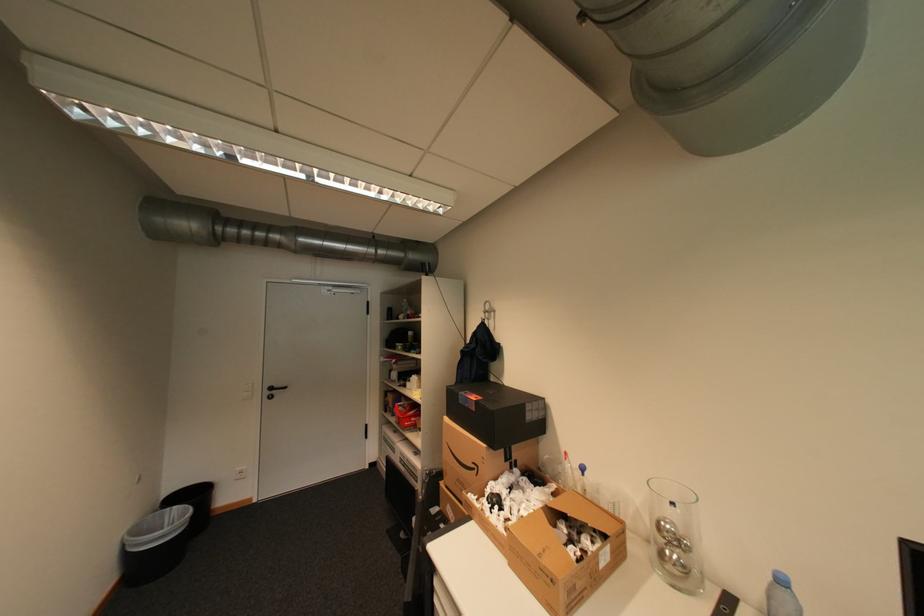
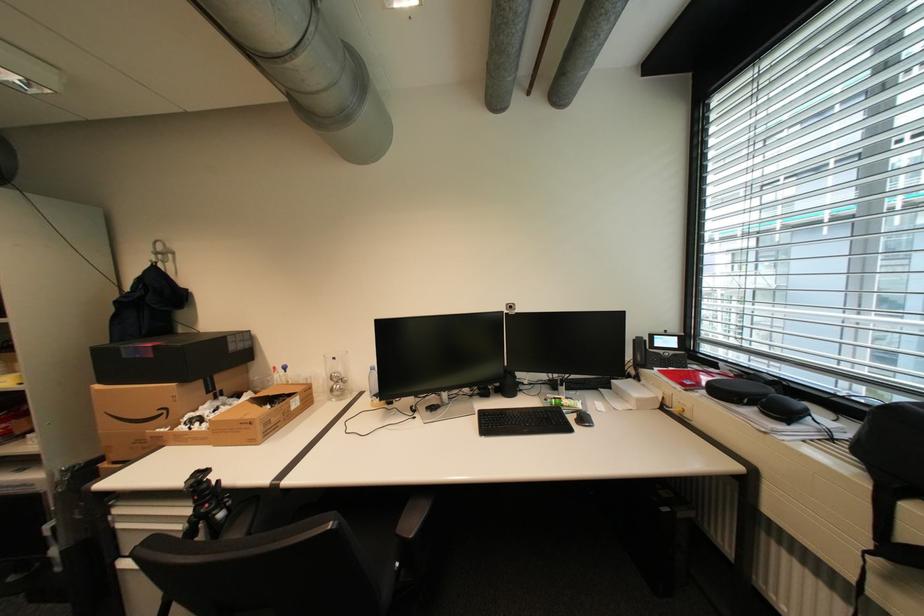
Question: The camera is either moving clockwise (left) or counter-clockwise (right) around the object. The first image is from the beginning of the video and the second image is from the end. Is the camera moving left or right when shooting the video?

Choices:
 (A) Left
 (B) Right

Answer: (A)